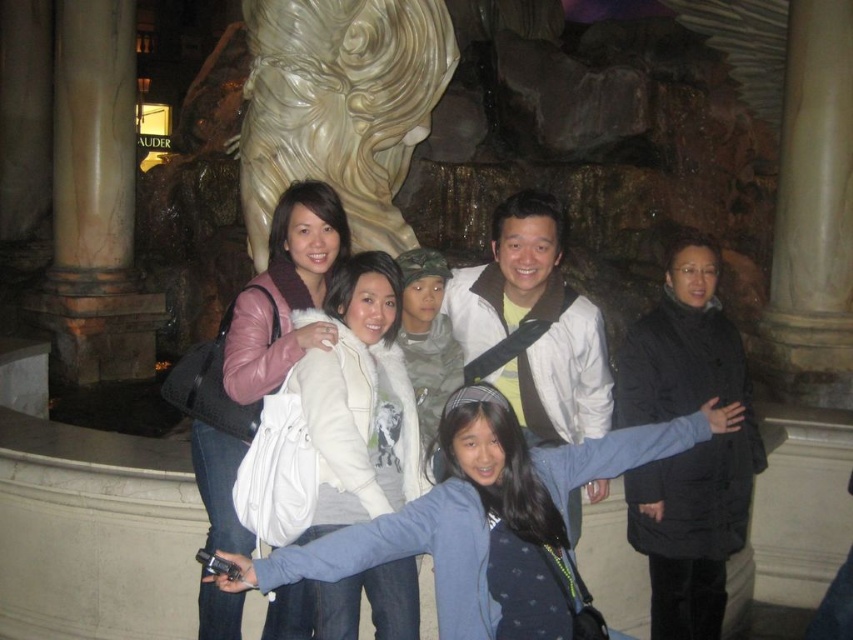
Question: Is light blue sweater at center below matte pink leather jacket at center?

Choices:
 (A) yes
 (B) no

Answer: (A)

Question: In this image, where is black matte coat at center located relative to matte pink leather jacket at center?

Choices:
 (A) left
 (B) right

Answer: (B)

Question: Which of these objects is positioned farthest from the white fleece jacket at center?

Choices:
 (A) marble column at left
 (B) light blue sweater at center

Answer: (A)

Question: Which object is positioned farthest from the black matte coat at center?

Choices:
 (A) white fleece jacket at center
 (B) white matte jacket at center
 (C) white marble statue at center
 (D) matte pink leather jacket at center

Answer: (C)

Question: Which point is closer to the camera?

Choices:
 (A) (100, 272)
 (B) (419, 61)
 (C) (413, 529)

Answer: (C)

Question: Does white marble statue at center appear on the right side of white matte jacket at center?

Choices:
 (A) yes
 (B) no

Answer: (B)